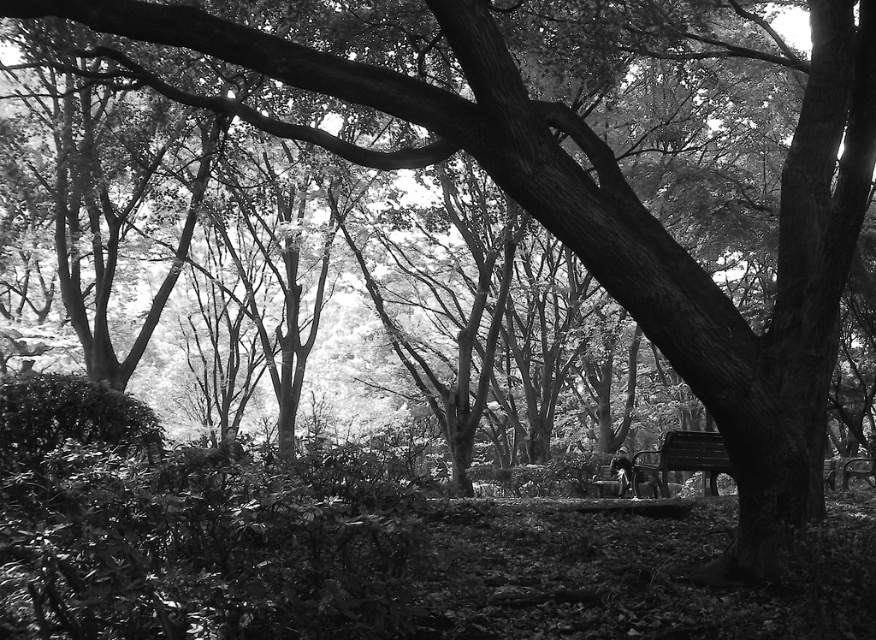
Question: Does wooden bench at center lie behind smooth black jacket at center?

Choices:
 (A) no
 (B) yes

Answer: (A)

Question: Which point is farther from the camera taking this photo?

Choices:
 (A) (714, 492)
 (B) (625, 490)

Answer: (B)

Question: Is wooden bench at center closer to camera compared to smooth black jacket at center?

Choices:
 (A) yes
 (B) no

Answer: (A)

Question: Does wooden bench at center appear under smooth black jacket at center?

Choices:
 (A) no
 (B) yes

Answer: (A)

Question: Among these objects, which one is nearest to the camera?

Choices:
 (A) smooth black jacket at center
 (B) wooden bench at center

Answer: (B)